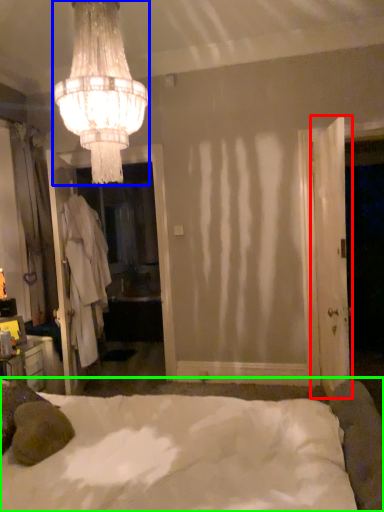
Question: Which object is positioned farthest from door (highlighted by a red box)? Select from lamp (highlighted by a blue box) and bed (highlighted by a green box).

Choices:
 (A) lamp
 (B) bed

Answer: (A)